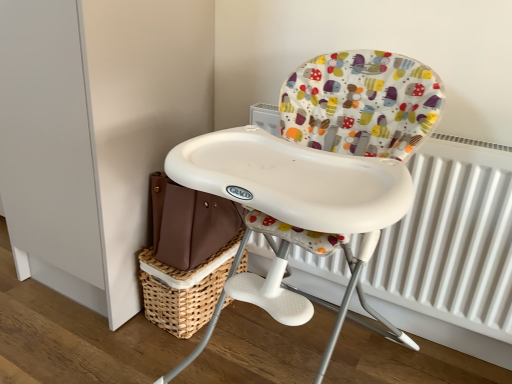
Question: From the image's perspective, is white plastic highchair at center located above or below woven brown basket at lower center?

Choices:
 (A) above
 (B) below

Answer: (A)

Question: Based on their positions, is white plastic highchair at center located to the left or right of woven brown basket at lower center?

Choices:
 (A) left
 (B) right

Answer: (B)

Question: Which object is the farthest from the woven brown basket at lower center?

Choices:
 (A) white metallic radiator at right
 (B) white plastic highchair at center

Answer: (A)

Question: Considering the real-world distances, which object is farthest from the white plastic highchair at center?

Choices:
 (A) woven brown basket at lower center
 (B) white metallic radiator at right

Answer: (A)